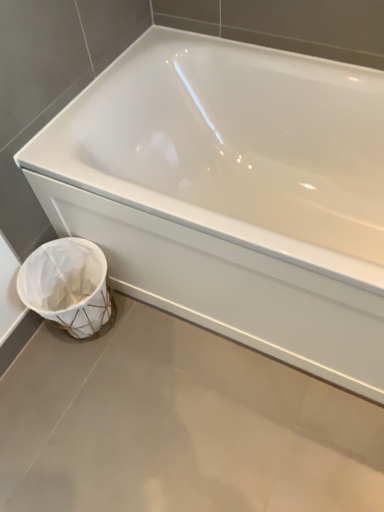
Question: Is white woven basket at lower left directly adjacent to white glossy bathtub at lower left?

Choices:
 (A) yes
 (B) no

Answer: (B)

Question: Is white woven basket at lower left not close to white glossy bathtub at lower left?

Choices:
 (A) no
 (B) yes

Answer: (A)

Question: Could you tell me if white woven basket at lower left is facing white glossy bathtub at lower left?

Choices:
 (A) no
 (B) yes

Answer: (A)

Question: Is white woven basket at lower left behind white glossy bathtub at lower left?

Choices:
 (A) yes
 (B) no

Answer: (A)

Question: Is white glossy bathtub at lower left at the back of white woven basket at lower left?

Choices:
 (A) no
 (B) yes

Answer: (B)

Question: From the image's perspective, would you say white woven basket at lower left is shown under white glossy bathtub at lower left?

Choices:
 (A) yes
 (B) no

Answer: (A)

Question: From the image's perspective, is white glossy bathtub at lower left located above white woven basket at lower left?

Choices:
 (A) yes
 (B) no

Answer: (A)

Question: Are white glossy bathtub at lower left and white woven basket at lower left beside each other?

Choices:
 (A) yes
 (B) no

Answer: (B)

Question: Does white glossy bathtub at lower left have a larger size compared to white woven basket at lower left?

Choices:
 (A) no
 (B) yes

Answer: (B)

Question: Does white glossy bathtub at lower left have a greater width compared to white woven basket at lower left?

Choices:
 (A) yes
 (B) no

Answer: (A)

Question: Can you confirm if white glossy bathtub at lower left is smaller than white woven basket at lower left?

Choices:
 (A) no
 (B) yes

Answer: (A)

Question: Is white glossy bathtub at lower left at the left side of white woven basket at lower left?

Choices:
 (A) no
 (B) yes

Answer: (A)

Question: In terms of width, does white woven basket at lower left look wider or thinner when compared to white glossy bathtub at lower left?

Choices:
 (A) wide
 (B) thin

Answer: (B)